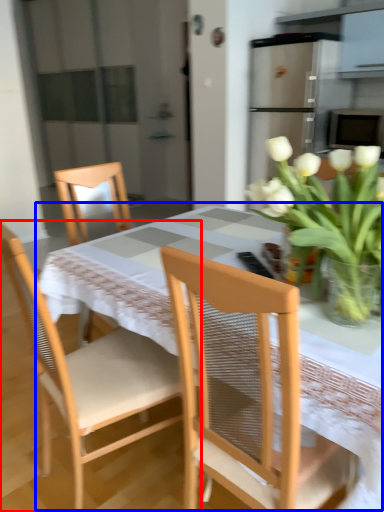
Question: Which object appears farthest to the camera in this image, chair (highlighted by a red box) or kitchen & dining room table (highlighted by a blue box)?

Choices:
 (A) chair
 (B) kitchen & dining room table

Answer: (A)